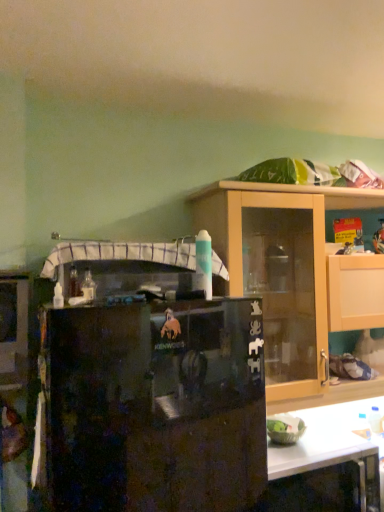
Question: Is wooden cabinet at upper right taller than black matte refrigerator at center?

Choices:
 (A) no
 (B) yes

Answer: (A)

Question: Can you confirm if wooden cabinet at upper right is positioned to the left of black matte refrigerator at center?

Choices:
 (A) no
 (B) yes

Answer: (A)

Question: Is wooden cabinet at upper right behind black matte refrigerator at center?

Choices:
 (A) yes
 (B) no

Answer: (A)

Question: Is wooden cabinet at upper right far away from black matte refrigerator at center?

Choices:
 (A) yes
 (B) no

Answer: (B)

Question: Is wooden cabinet at upper right positioned before black matte refrigerator at center?

Choices:
 (A) no
 (B) yes

Answer: (A)

Question: Is wooden cabinet at upper right in contact with black matte refrigerator at center?

Choices:
 (A) no
 (B) yes

Answer: (A)

Question: Is black matte refrigerator at center touching wooden cabinet at upper right?

Choices:
 (A) yes
 (B) no

Answer: (B)

Question: Is black matte refrigerator at center oriented towards wooden cabinet at upper right?

Choices:
 (A) yes
 (B) no

Answer: (B)

Question: From the image's perspective, does black matte refrigerator at center appear higher than wooden cabinet at upper right?

Choices:
 (A) yes
 (B) no

Answer: (B)

Question: From a real-world perspective, is black matte refrigerator at center on wooden cabinet at upper right?

Choices:
 (A) no
 (B) yes

Answer: (A)

Question: Does black matte refrigerator at center have a greater width compared to wooden cabinet at upper right?

Choices:
 (A) yes
 (B) no

Answer: (A)

Question: Is black matte refrigerator at center located outside wooden cabinet at upper right?

Choices:
 (A) yes
 (B) no

Answer: (A)

Question: From a real-world perspective, is black matte refrigerator at center above or below wooden cabinet at upper right?

Choices:
 (A) below
 (B) above

Answer: (A)